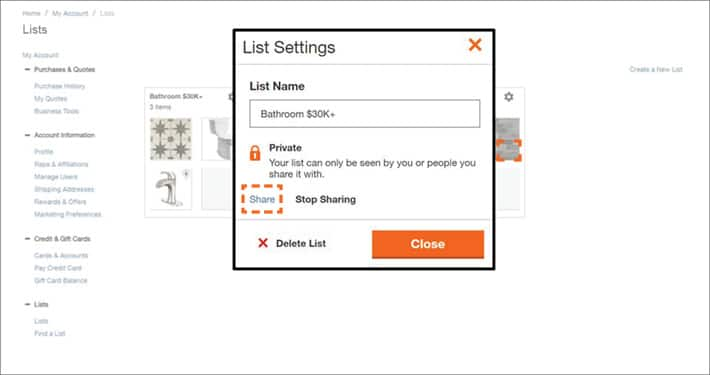
This screenshot has height=375, width=710. What are the coordinates of `tiling` in the screenshot? It's located at (173, 137).